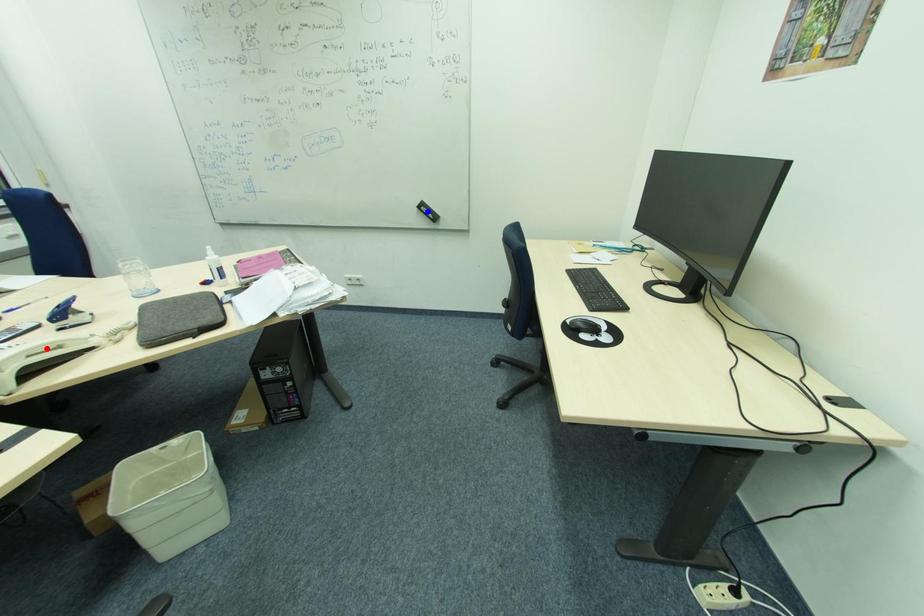
Question: In the image, two points are highlighted. Which point is nearer to the camera? Reply with the corresponding letter.

Choices:
 (A) blue point
 (B) red point

Answer: (B)